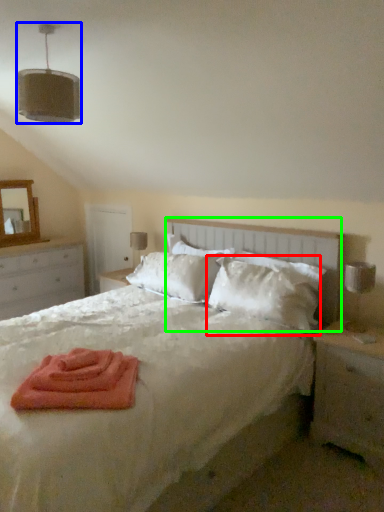
Question: Which object is positioned closest to pillow (highlighted by a red box)? Select from light fixture (highlighted by a blue box) and headboard (highlighted by a green box).

Choices:
 (A) light fixture
 (B) headboard

Answer: (B)